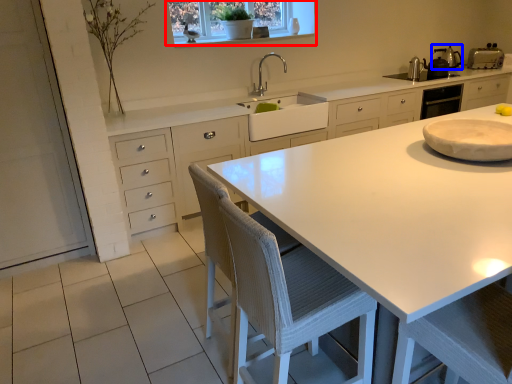
Question: Which object appears farthest to the camera in this image, window (highlighted by a red box) or appliance (highlighted by a blue box)?

Choices:
 (A) window
 (B) appliance

Answer: (B)